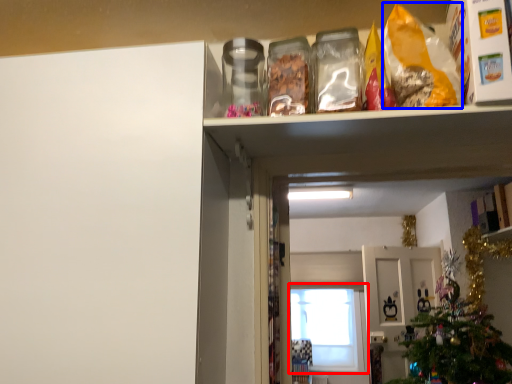
Question: Which object appears closest to the camera in this image, window (highlighted by a red box) or cereal (highlighted by a blue box)?

Choices:
 (A) window
 (B) cereal

Answer: (B)